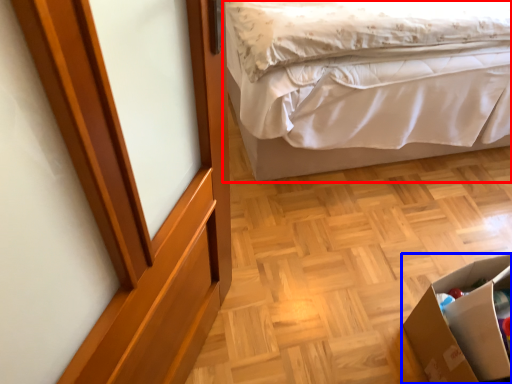
Question: Which object appears farthest to the camera in this image, bed (highlighted by a red box) or cardboard box (highlighted by a blue box)?

Choices:
 (A) bed
 (B) cardboard box

Answer: (A)